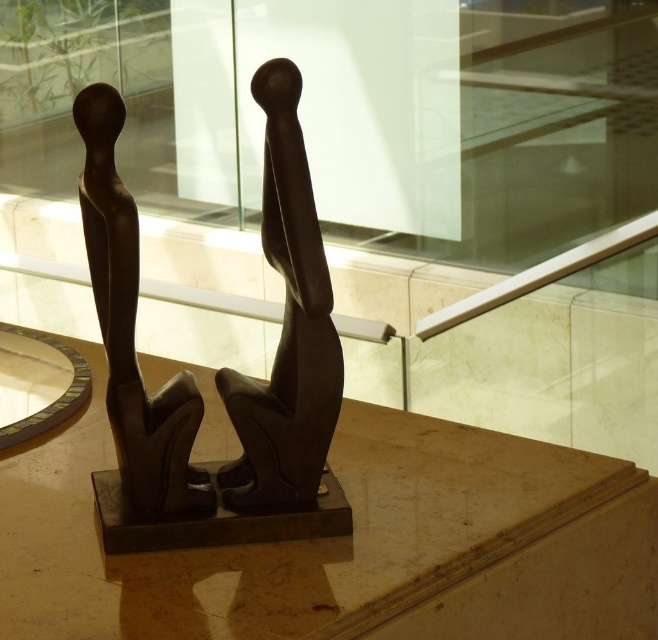
Is point (270, 449) positioned after point (89, 205)?

That is True.

Looking at this image, can you confirm if matte black sculpture at center is positioned to the left of matte bronze sculpture at left?

In fact, matte black sculpture at center is to the right of matte bronze sculpture at left.

Which is in front, point (324, 266) or point (89, 164)?

Point (324, 266)

Find the location of a particular element. The height and width of the screenshot is (640, 658). matte black sculpture at center is located at coordinates (286, 328).

Can you confirm if matte bronze sculpture at center is bigger than matte black sculpture at center?

Yes, matte bronze sculpture at center is bigger than matte black sculpture at center.

Is matte bronze sculpture at center positioned behind matte black sculpture at center?

No.

Describe the element at coordinates (218, 369) in the screenshot. The width and height of the screenshot is (658, 640). I see `matte bronze sculpture at center` at that location.

Find the location of a particular element. This screenshot has width=658, height=640. matte bronze sculpture at center is located at coordinates (218, 369).

Between point (130, 220) and point (97, 166), which one is positioned in front?

Point (130, 220) is in front.

Which is below, matte bronze sculpture at center or matte bronze sculpture at left?

matte bronze sculpture at left

Does point (134, 440) lie in front of point (116, 353)?

That is False.

Locate an element on the screen. Image resolution: width=658 pixels, height=640 pixels. matte bronze sculpture at center is located at coordinates (218, 369).